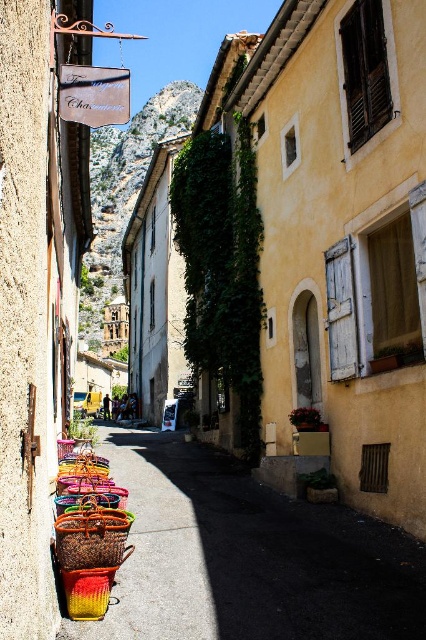
Who is taller, smooth concrete pavement at center or wooden signboard at upper left?

With more height is wooden signboard at upper left.

Who is shorter, smooth concrete pavement at center or wooden signboard at upper left?

smooth concrete pavement at center is shorter.

Is point (175, 627) behind point (97, 125)?

No.

Locate an element on the screen. The width and height of the screenshot is (426, 640). smooth concrete pavement at center is located at coordinates (247, 556).

Describe the element at coordinates (91, 548) in the screenshot. I see `bright yellow woven basket at center` at that location.

Does bright yellow woven basket at center have a greater height compared to wooden signboard at upper left?

No.

Which is in front, point (109, 593) or point (81, 84)?

Positioned in front is point (109, 593).

What are the coordinates of `bright yellow woven basket at center` in the screenshot? It's located at (91, 548).

What do you see at coordinates (247, 556) in the screenshot?
I see `smooth concrete pavement at center` at bounding box center [247, 556].

Is smooth concrete pavement at center positioned before bright yellow woven basket at center?

Yes, smooth concrete pavement at center is in front of bright yellow woven basket at center.

Where is `smooth concrete pavement at center`? The height and width of the screenshot is (640, 426). smooth concrete pavement at center is located at coordinates (247, 556).